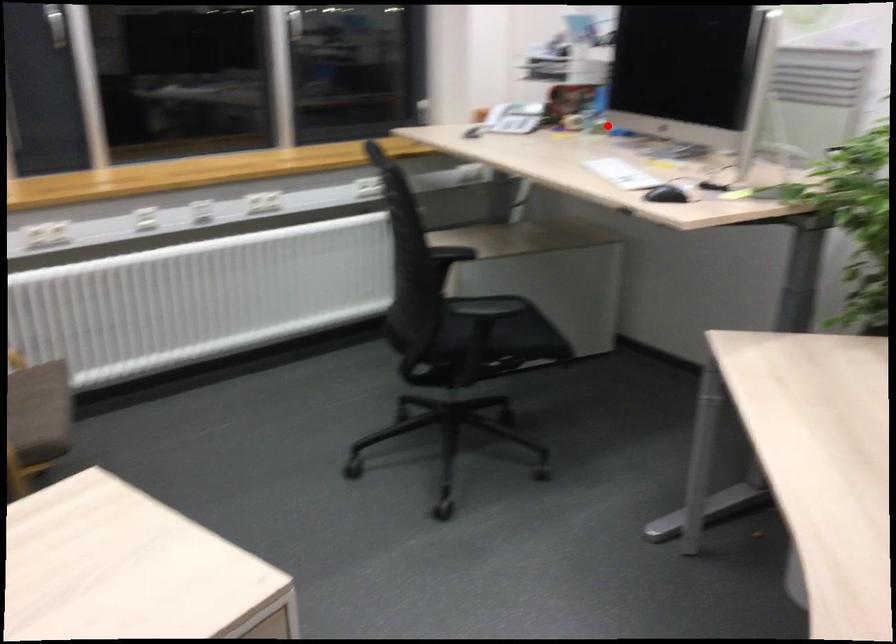
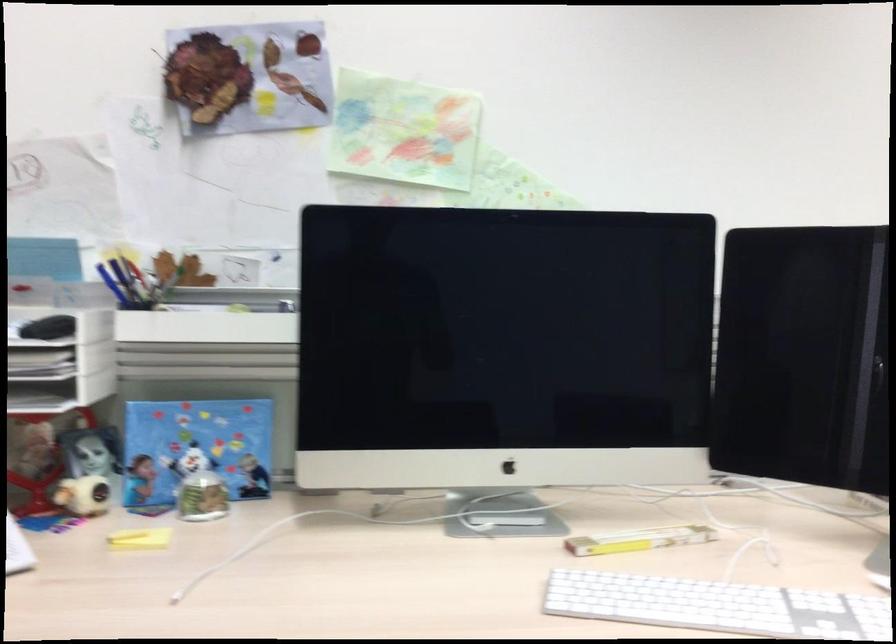
The point at the highlighted location is marked in the first image. Where is the corresponding point in the second image?

(202, 497)